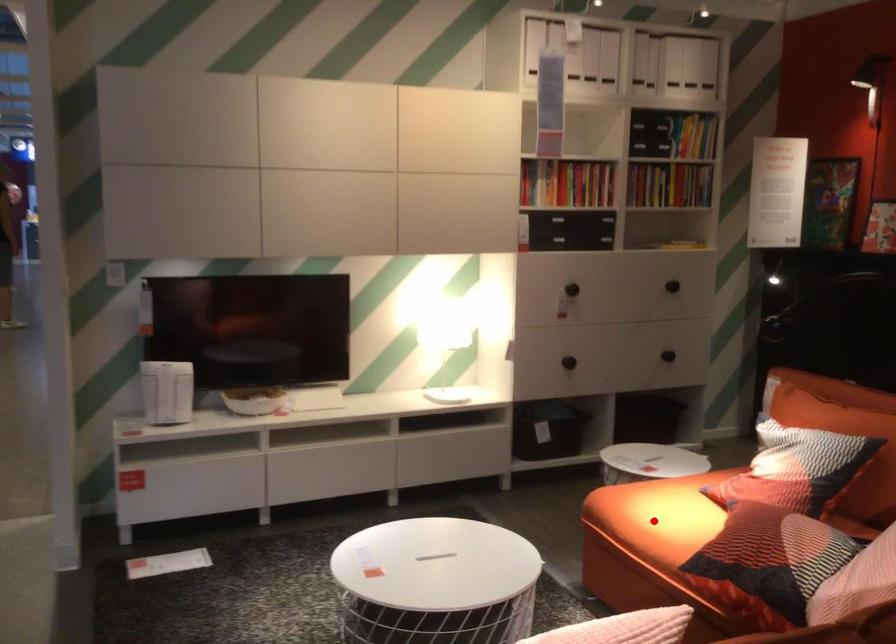
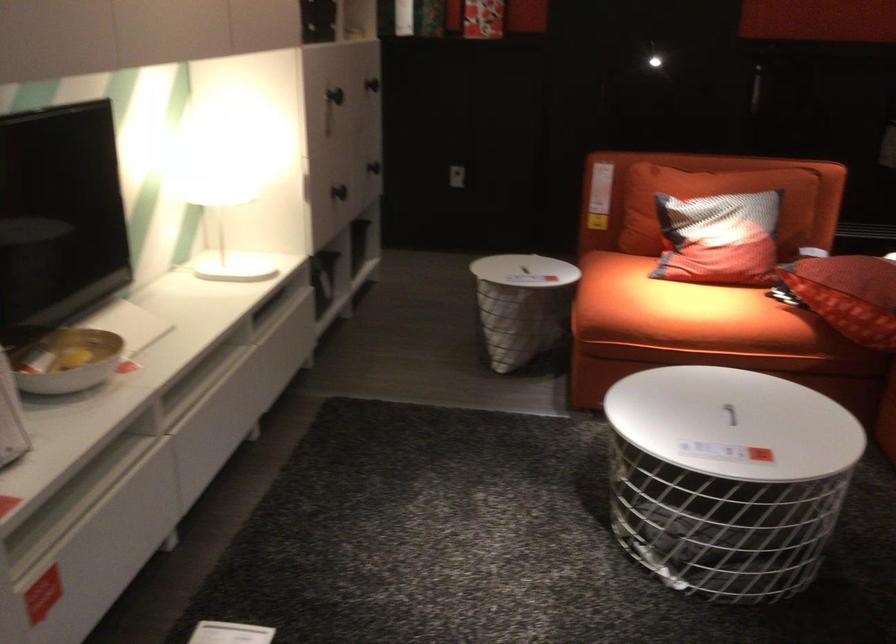
Where in the second image is the point corresponding to the highlighted location from the first image?

(684, 312)